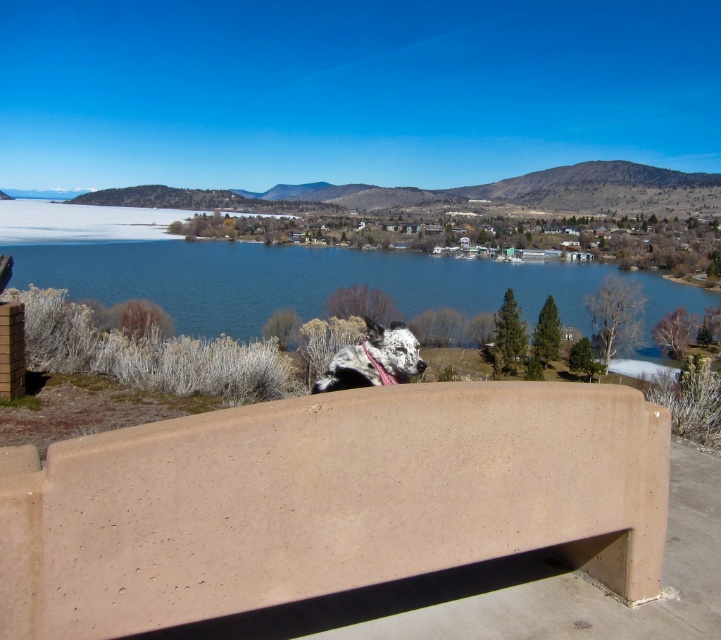
You are standing at the edge of the lake and want to sit on the matte concrete bench at center while keeping an eye on the blue water at center. Which object is closer to you so you can easily monitor the water?

The matte concrete bench at center is closer to you than the blue water at center, so you can easily monitor the water while sitting on it.

You are standing on the viewing platform and want to sit down on the matte concrete bench at center. However, you notice the blue water at center is directly in front of you. Which object is closer to your current position?

The matte concrete bench at center is closer to your current position because it is located below the blue water at center, meaning it is positioned in front of the water.

You are a photographer wanting to capture the blue water at center and the matte concrete bench at center in the same frame. Based on their positions, which object should you focus on first to ensure both are in the shot?

The matte concrete bench at center is positioned on the right side of blue water at center. To include both in the frame, focus on the blue water at center first as it is centrally located, then adjust to ensure the matte concrete bench at center on its right is also captured.